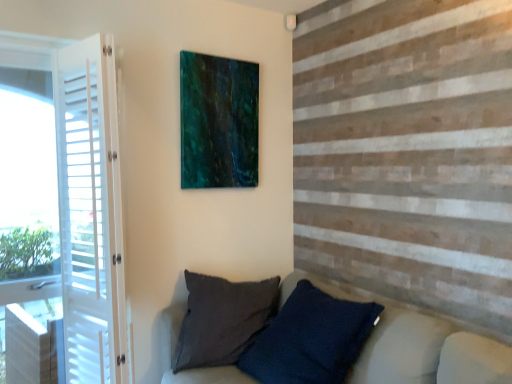
Question: Considering the relative sizes of teal glossy painting at upper center and white wood screen door at left in the image provided, is teal glossy painting at upper center thinner than white wood screen door at left?

Choices:
 (A) yes
 (B) no

Answer: (A)

Question: Is teal glossy painting at upper center shorter than white wood screen door at left?

Choices:
 (A) no
 (B) yes

Answer: (B)

Question: From the image's perspective, is teal glossy painting at upper center on white wood screen door at left?

Choices:
 (A) yes
 (B) no

Answer: (A)

Question: Can you confirm if teal glossy painting at upper center is smaller than white wood screen door at left?

Choices:
 (A) yes
 (B) no

Answer: (A)

Question: Is teal glossy painting at upper center not inside white wood screen door at left?

Choices:
 (A) no
 (B) yes

Answer: (B)

Question: Choose the correct answer: Is teal glossy painting at upper center inside dark blue textured pillow at lower center or outside it?

Choices:
 (A) outside
 (B) inside

Answer: (A)

Question: Based on their sizes in the image, would you say teal glossy painting at upper center is bigger or smaller than dark blue textured pillow at lower center?

Choices:
 (A) small
 (B) big

Answer: (A)

Question: From the image's perspective, is teal glossy painting at upper center located above or below dark blue textured pillow at lower center?

Choices:
 (A) above
 (B) below

Answer: (A)

Question: Is teal glossy painting at upper center wider or thinner than dark blue textured pillow at lower center?

Choices:
 (A) wide
 (B) thin

Answer: (B)

Question: From the image's perspective, is dark blue textured pillow at lower center above or below white wood screen door at left?

Choices:
 (A) below
 (B) above

Answer: (A)

Question: Is dark blue textured pillow at lower center bigger or smaller than white wood screen door at left?

Choices:
 (A) small
 (B) big

Answer: (B)

Question: Considering their positions, is dark blue textured pillow at lower center located in front of or behind white wood screen door at left?

Choices:
 (A) front
 (B) behind

Answer: (A)

Question: In the image, is dark blue textured pillow at lower center on the left side or the right side of white wood screen door at left?

Choices:
 (A) right
 (B) left

Answer: (A)

Question: Considering the positions of white wood screen door at left and dark blue textured pillow at lower center in the image, is white wood screen door at left bigger or smaller than dark blue textured pillow at lower center?

Choices:
 (A) big
 (B) small

Answer: (B)

Question: In the image, is white wood screen door at left positioned in front of or behind dark blue textured pillow at lower center?

Choices:
 (A) front
 (B) behind

Answer: (B)